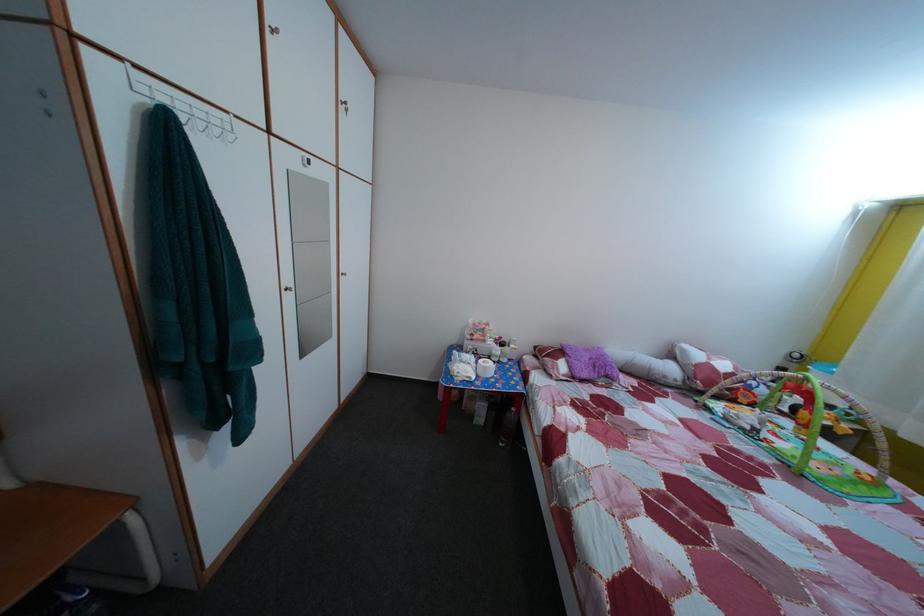
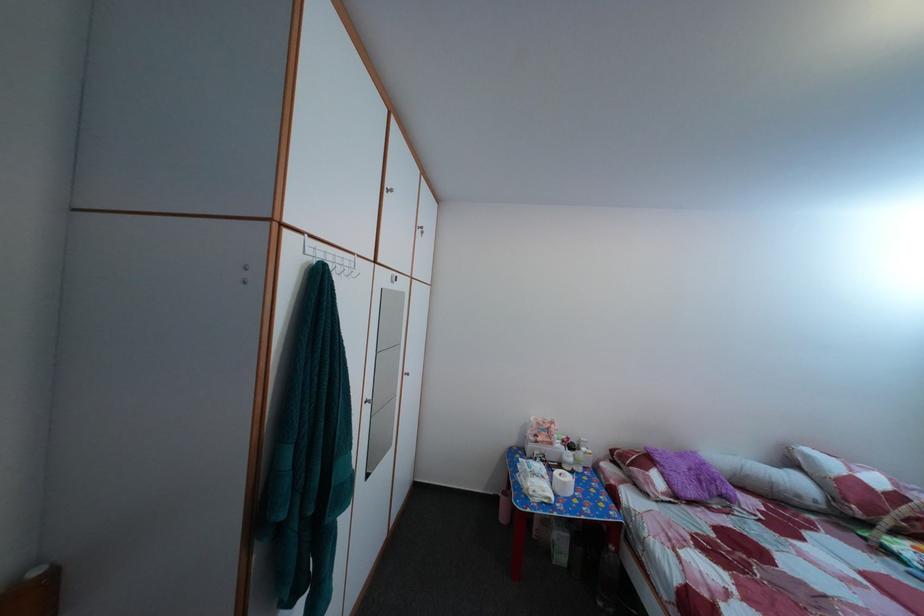
Question: What movement of the cameraman would produce the second image?

Choices:
 (A) Left
 (B) Right
 (C) Forward
 (D) Backward

Answer: (A)